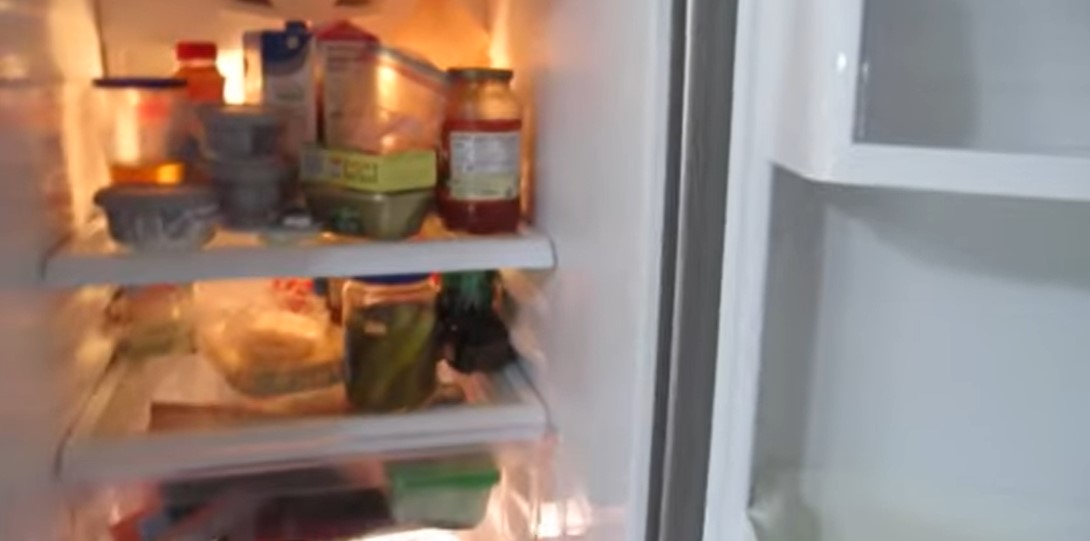
Where is `fridge door`? The image size is (1090, 541). fridge door is located at coordinates (879, 278).